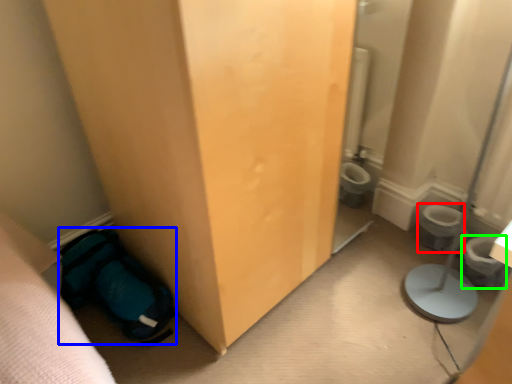
Question: Which object is positioned farthest from toilet bowl (highlighted by a red box)? Select from sleeping bag (highlighted by a blue box) and potty (highlighted by a green box).

Choices:
 (A) sleeping bag
 (B) potty

Answer: (A)